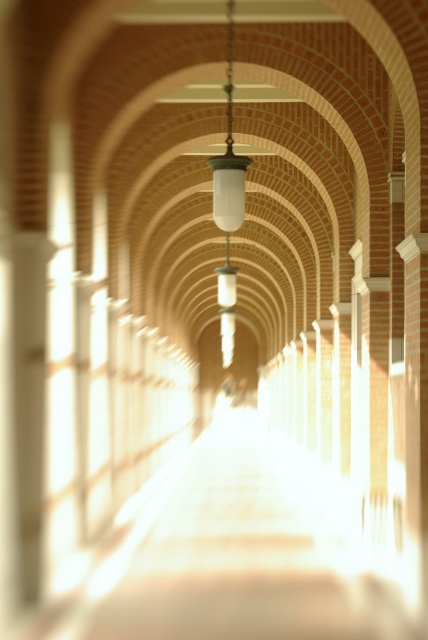
Between white glossy path at center and matte glass lamp at center, which one is positioned lower?

white glossy path at center

Image resolution: width=428 pixels, height=640 pixels. In order to click on white glossy path at center in this screenshot , I will do `click(231, 556)`.